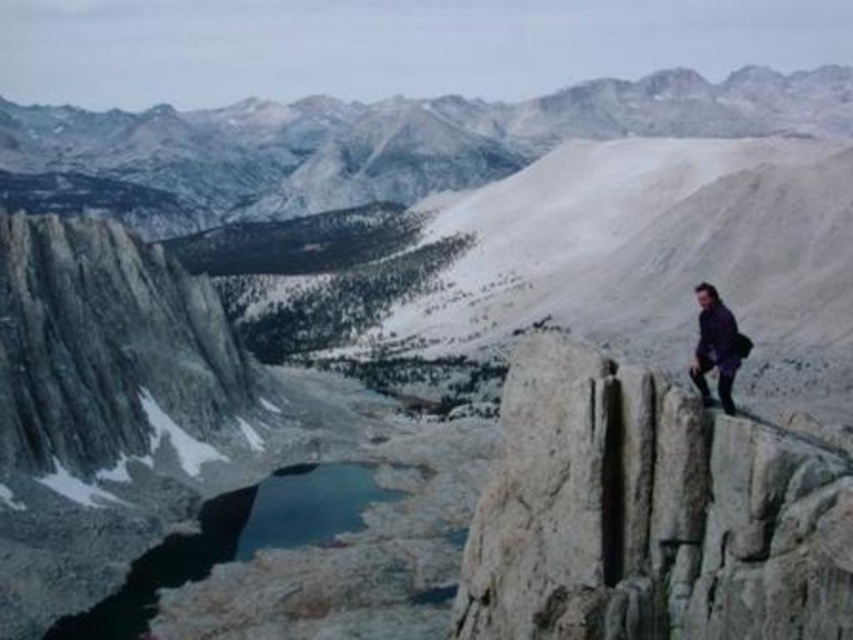
Question: Which object is farther from the camera taking this photo?

Choices:
 (A) blue glassy lake at lower left
 (B) purple matte jacket at right
 (C) white rough rock at right

Answer: (A)

Question: Is blue glassy lake at lower left below purple matte jacket at right?

Choices:
 (A) yes
 (B) no

Answer: (A)

Question: Among these points, which one is farthest from the camera?

Choices:
 (A) (701, 292)
 (B) (245, 557)

Answer: (B)

Question: Is white rough rock at right below blue glassy lake at lower left?

Choices:
 (A) yes
 (B) no

Answer: (B)

Question: Among these points, which one is farthest from the camera?

Choices:
 (A) (282, 502)
 (B) (691, 422)
 (C) (720, 342)

Answer: (A)

Question: Does white rough rock at right appear on the right side of purple matte jacket at right?

Choices:
 (A) no
 (B) yes

Answer: (A)